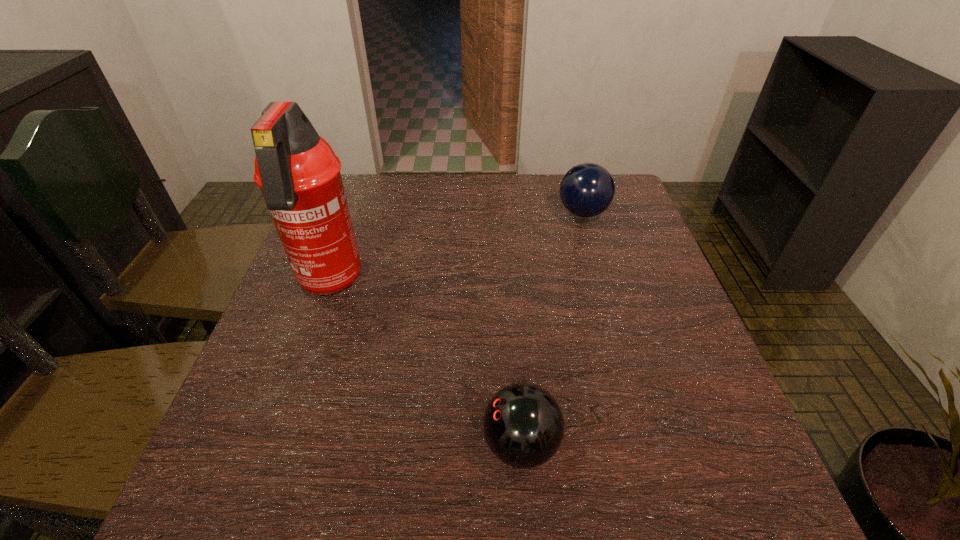
This screenshot has width=960, height=540. What are the coordinates of `fire extinguisher` in the screenshot? It's located at (299, 175).

The height and width of the screenshot is (540, 960). What are the coordinates of `the leftmost object` in the screenshot? It's located at (299, 175).

Identify the location of the farthest object. (586, 190).

Find the location of a particular element. Image resolution: width=960 pixels, height=540 pixels. the rightmost object is located at coordinates (586, 190).

Identify the location of the second object from right to left. pyautogui.click(x=523, y=425).

Find the location of a particular element. This screenshot has width=960, height=540. the nearest object is located at coordinates (523, 425).

Find the location of a particular element. vacant region located on the trigger side of the leftmost object is located at coordinates (252, 494).

Identify the location of free space located 0.300m on the surface of the farthest object near the finger holes. This screenshot has width=960, height=540. (449, 213).

Locate an element on the screen. This screenshot has height=540, width=960. vacant region located 0.370m on the surface of the farthest object near the finger holes is located at coordinates (424, 213).

Locate an element on the screen. The image size is (960, 540). free spot located on the surface of the farthest object near the finger holes is located at coordinates (499, 213).